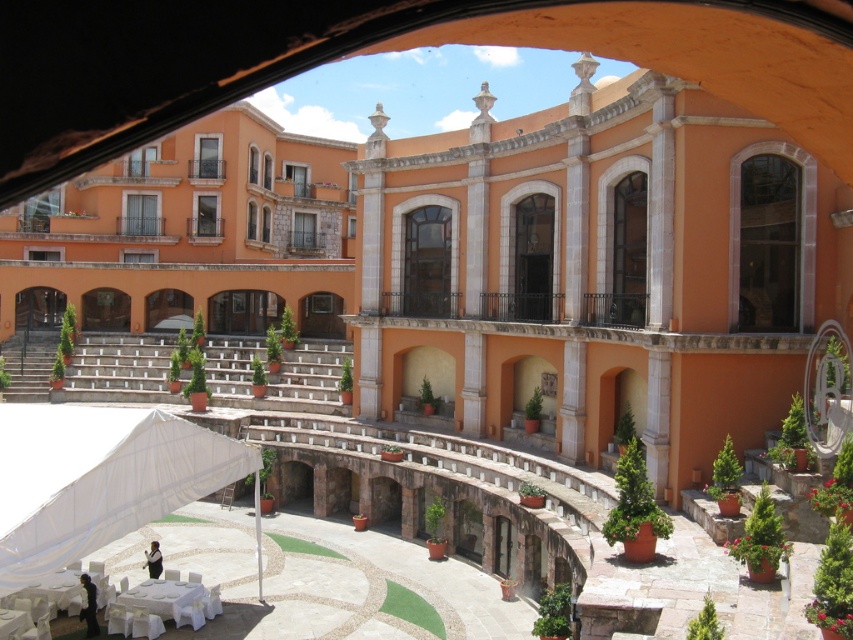
From the picture: You are standing in the courtyard of the grand building and need to find the white fabric canopy at lower left. According to the courtyard layout, where should you look relative to the entrance arches?

The white fabric canopy at lower left is located at point (97,477), which is to the left side of the entrance arches in the lower part of the courtyard.